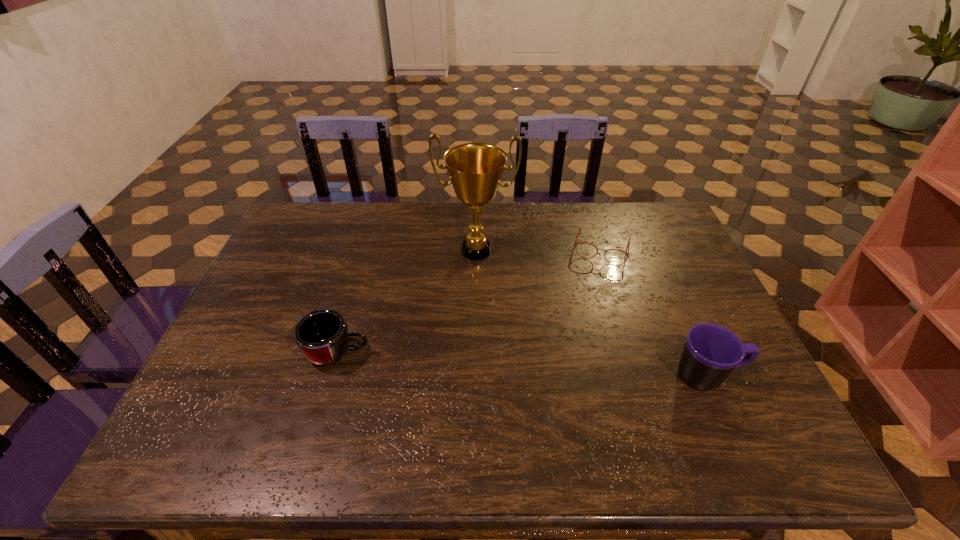
The image size is (960, 540). Identify the location of free space at the near edge of the desktop. (363, 395).

I want to click on free location at the left edge of the desktop, so click(x=294, y=264).

In the image, there is a desktop. In order to click on vacant space at the right edge in this screenshot , I will do `click(663, 258)`.

In the image, there is a desktop. Where is `blank space at the far right corner`? The width and height of the screenshot is (960, 540). blank space at the far right corner is located at coordinates pyautogui.click(x=650, y=241).

Where is `vacant space that's between the third object from right to left and the left mug`? vacant space that's between the third object from right to left and the left mug is located at coordinates (407, 302).

The height and width of the screenshot is (540, 960). What are the coordinates of `unoccupied position between the shortest object and the leftmost object` in the screenshot? It's located at (469, 301).

I want to click on free space between the spectacles and the taller mug, so click(655, 312).

Where is `vacant space that's between the right mug and the second object from left to right`? vacant space that's between the right mug and the second object from left to right is located at coordinates (592, 313).

Locate an element on the screen. This screenshot has width=960, height=540. free spot between the shorter mug and the tallest object is located at coordinates (407, 302).

The image size is (960, 540). In order to click on vacant area that lies between the second shortest object and the spectacles in this screenshot , I will do `click(469, 301)`.